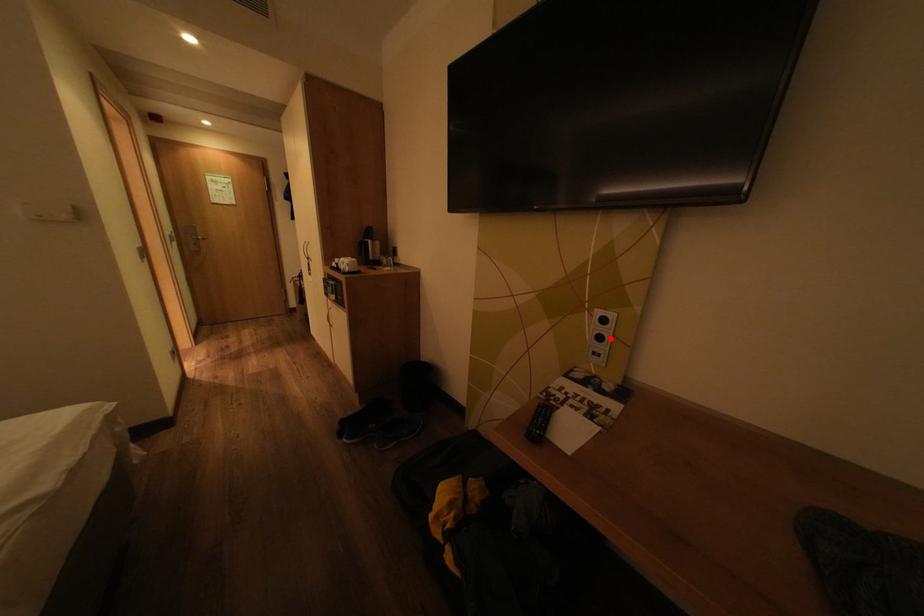
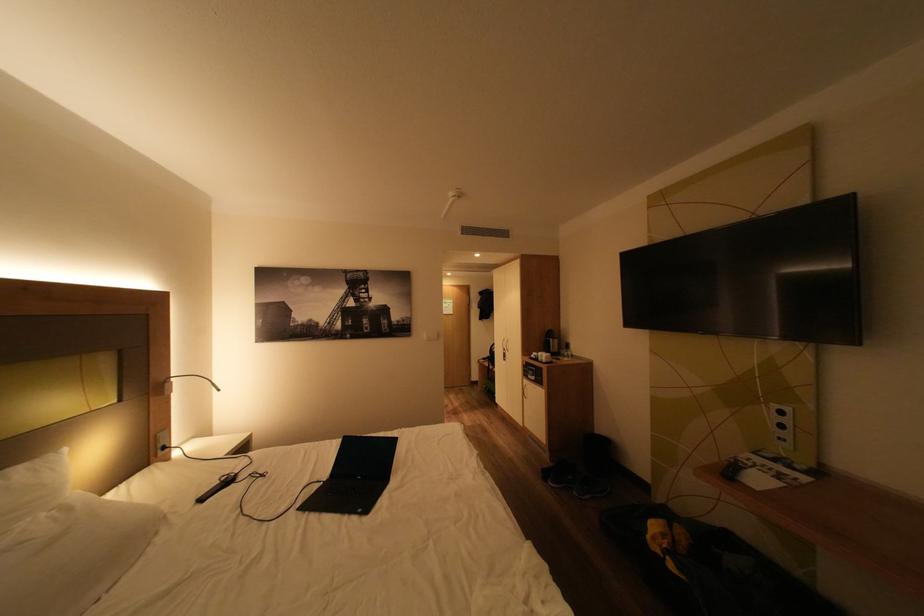
Locate, in the second image, the point that corresponds to the highlighted location in the first image.

(793, 427)